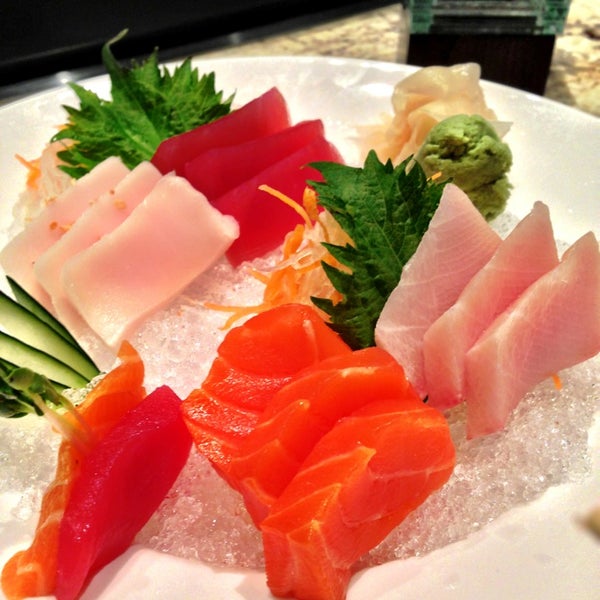
Locate an element on the screen. Image resolution: width=600 pixels, height=600 pixels. table is located at coordinates (349, 41).